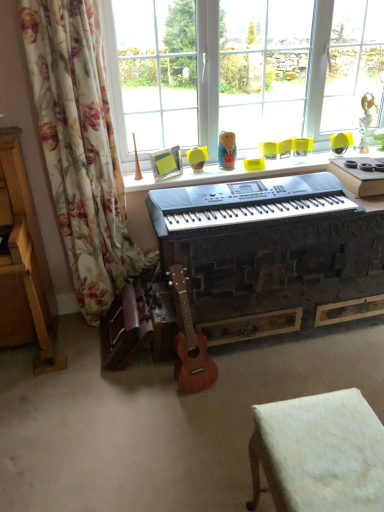
Question: Are wooden acoustic guitar at center and black plastic keyboard at center located far from each other?

Choices:
 (A) no
 (B) yes

Answer: (A)

Question: From a real-world perspective, is wooden acoustic guitar at center physically above black plastic keyboard at center?

Choices:
 (A) no
 (B) yes

Answer: (A)

Question: Is wooden acoustic guitar at center at the left side of black plastic keyboard at center?

Choices:
 (A) yes
 (B) no

Answer: (A)

Question: Considering the relative sizes of wooden acoustic guitar at center and black plastic keyboard at center in the image provided, is wooden acoustic guitar at center thinner than black plastic keyboard at center?

Choices:
 (A) no
 (B) yes

Answer: (B)

Question: Considering the relative sizes of wooden acoustic guitar at center and black plastic keyboard at center in the image provided, is wooden acoustic guitar at center bigger than black plastic keyboard at center?

Choices:
 (A) yes
 (B) no

Answer: (B)

Question: In terms of height, does transparent glass window at upper center look taller or shorter compared to white fabric stool at lower right?

Choices:
 (A) short
 (B) tall

Answer: (B)

Question: Considering the positions of transparent glass window at upper center and white fabric stool at lower right in the image, is transparent glass window at upper center bigger or smaller than white fabric stool at lower right?

Choices:
 (A) small
 (B) big

Answer: (B)

Question: Is point (205, 30) closer or farther from the camera than point (306, 459)?

Choices:
 (A) farther
 (B) closer

Answer: (A)

Question: From the image's perspective, is transparent glass window at upper center positioned above or below white fabric stool at lower right?

Choices:
 (A) below
 (B) above

Answer: (B)

Question: Would you say black plastic keyboard at center is inside or outside matte plastic doll at upper center?

Choices:
 (A) inside
 (B) outside

Answer: (B)

Question: From the image's perspective, is black plastic keyboard at center positioned above or below matte plastic doll at upper center?

Choices:
 (A) above
 (B) below

Answer: (B)

Question: Relative to matte plastic doll at upper center, is black plastic keyboard at center in front or behind?

Choices:
 (A) behind
 (B) front

Answer: (B)

Question: Looking at their shapes, would you say black plastic keyboard at center is wider or thinner than matte plastic doll at upper center?

Choices:
 (A) wide
 (B) thin

Answer: (A)

Question: From the image's perspective, relative to black plastic keyboard at center, is wooden acoustic guitar at center above or below?

Choices:
 (A) above
 (B) below

Answer: (B)

Question: Considering the positions of wooden acoustic guitar at center and black plastic keyboard at center in the image, is wooden acoustic guitar at center bigger or smaller than black plastic keyboard at center?

Choices:
 (A) big
 (B) small

Answer: (B)